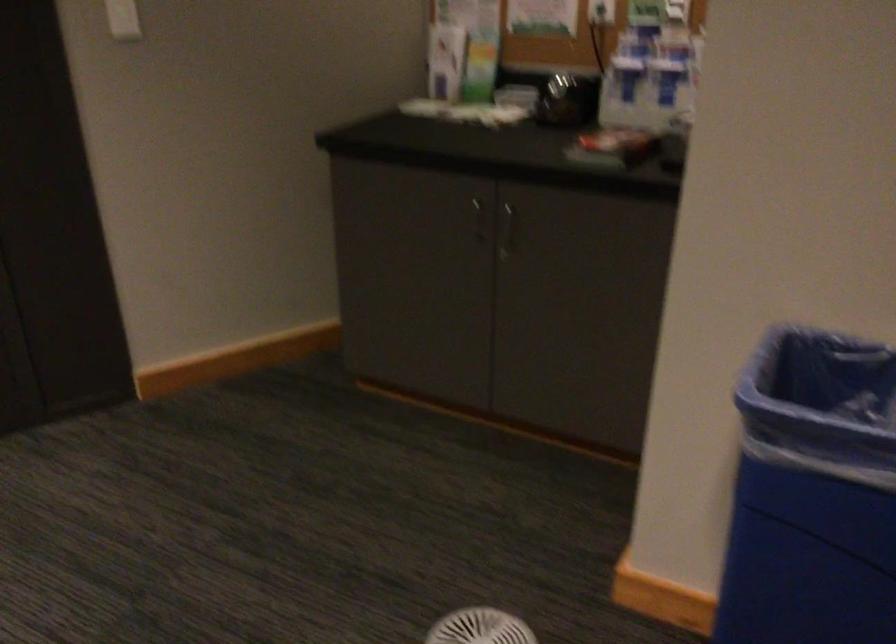
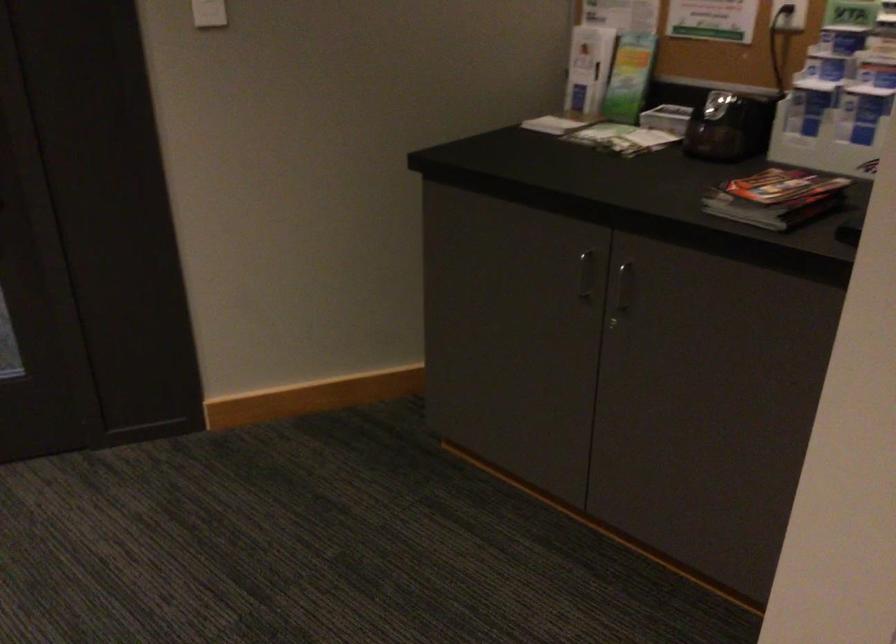
The point at (x=479, y=216) is marked in the first image. Where is the corresponding point in the second image?

(584, 275)